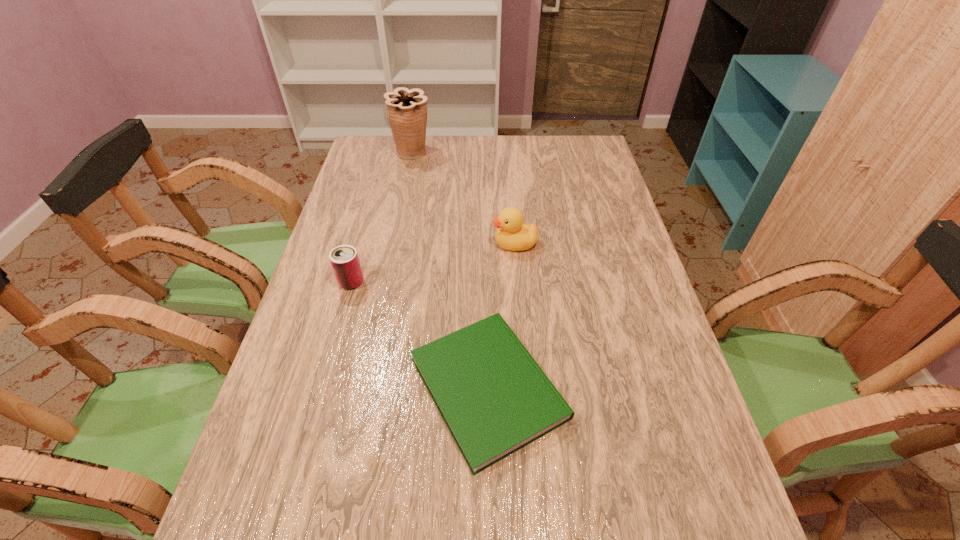
This screenshot has height=540, width=960. Find the location of `vacant space at the right edge of the desktop`. vacant space at the right edge of the desktop is located at coordinates (627, 336).

This screenshot has height=540, width=960. I want to click on free location at the far left corner, so click(x=362, y=162).

Locate an element on the screen. This screenshot has width=960, height=540. free space between the second farthest object and the tallest object is located at coordinates (464, 198).

This screenshot has width=960, height=540. I want to click on empty space between the paperback book and the tallest object, so click(x=450, y=271).

This screenshot has height=540, width=960. In order to click on vacant space that is in between the duck and the shortest object in this screenshot , I will do `click(501, 315)`.

Image resolution: width=960 pixels, height=540 pixels. In order to click on free area in between the second shortest object and the second farthest object in this screenshot , I will do `click(433, 262)`.

Find the location of a particular element. unoccupied position between the farthest object and the shortest object is located at coordinates (450, 271).

At what (x,y) coordinates should I click in order to perform the action: click on vacant space in between the shortest object and the second shortest object. Please return your answer as a coordinate pair (x, y). The height and width of the screenshot is (540, 960). Looking at the image, I should click on (420, 335).

At what (x,y) coordinates should I click in order to perform the action: click on unoccupied position between the second nearest object and the urn. Please return your answer as a coordinate pair (x, y). Looking at the image, I should click on (382, 217).

At what (x,y) coordinates should I click in order to perform the action: click on empty space that is in between the paperback book and the second tallest object. Please return your answer as a coordinate pair (x, y). Image resolution: width=960 pixels, height=540 pixels. Looking at the image, I should click on (501, 315).